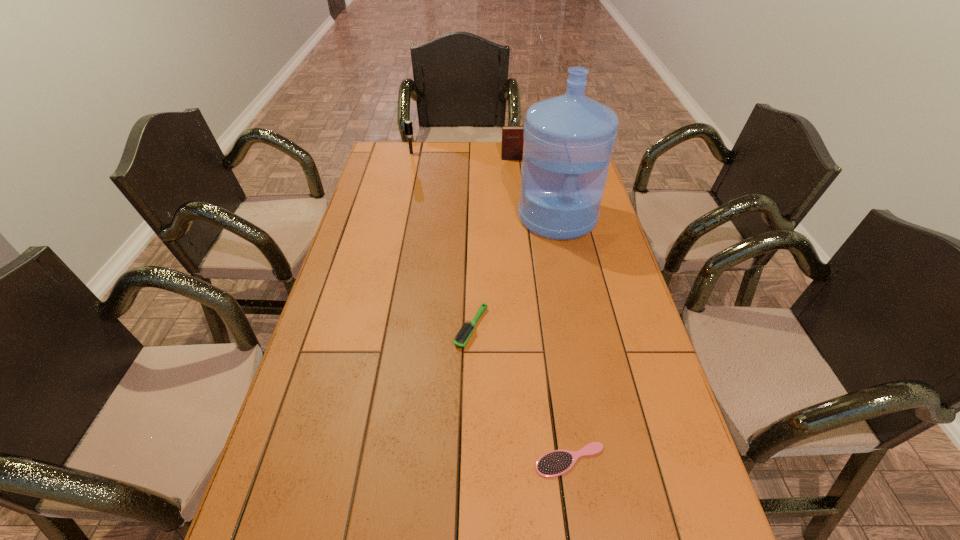
Locate an element on the screen. blank space located 0.110m on the left of the leftmost object is located at coordinates (382, 153).

The height and width of the screenshot is (540, 960). What are the coordinates of `vacant space located on the front cover of the diary` in the screenshot? It's located at (514, 178).

This screenshot has width=960, height=540. In order to click on free point located 0.290m on the front of the second nearest object in this screenshot , I will do `click(469, 459)`.

The width and height of the screenshot is (960, 540). I want to click on vacant space located 0.190m on the left of the nearest hairbrush, so click(x=446, y=460).

Identify the location of hairbrush at the far edge. (408, 126).

I want to click on diary located at the far edge, so click(512, 136).

Locate an element on the screen. The width and height of the screenshot is (960, 540). object at the left edge is located at coordinates (408, 126).

Locate an element on the screen. object situated at the right edge is located at coordinates (568, 143).

This screenshot has height=540, width=960. Identify the location of object present at the far left corner. (408, 126).

Image resolution: width=960 pixels, height=540 pixels. In order to click on blank area at the left edge in this screenshot , I will do `click(363, 245)`.